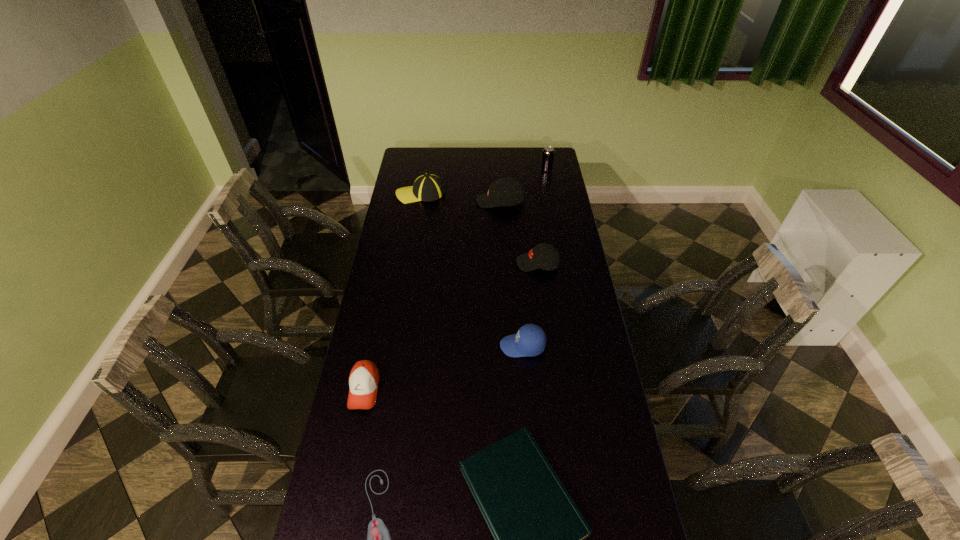
Locate an element on the screen. The width and height of the screenshot is (960, 540). the farthest object is located at coordinates (548, 153).

At what (x,y) coordinates should I click in order to perform the action: click on the third farthest baseball cap. Please return your answer as a coordinate pair (x, y). This screenshot has width=960, height=540. Looking at the image, I should click on (544, 256).

Locate an element on the screen. the fourth nearest object is located at coordinates (530, 340).

I want to click on the nearest baseball cap, so click(x=364, y=378).

You are a GUI agent. You are given a task and a screenshot of the screen. Output one action in this format:
    pyautogui.click(x=<x>, y=<y>)
    Task: Click on the blank area located on the left of the soda can
    The width and height of the screenshot is (960, 540).
    Given the screenshot: What is the action you would take?
    pyautogui.click(x=521, y=170)

The image size is (960, 540). What are the coordinates of `vacant region located on the front-facing side of the fourth farthest object` in the screenshot? It's located at (468, 264).

You are a GUI agent. You are given a task and a screenshot of the screen. Output one action in this format:
    pyautogui.click(x=<x>, y=<y>)
    Task: Click on the vacant space located 0.270m on the front-facing side of the fourth farthest object
    Image resolution: width=960 pixels, height=540 pixels.
    Given the screenshot: What is the action you would take?
    pyautogui.click(x=455, y=264)

Identify the location of vacant position located 0.200m on the front-facing side of the fourth farthest object. (471, 264).

Find the location of `free region located on the front-facing side of the fourth nearest object`. free region located on the front-facing side of the fourth nearest object is located at coordinates click(x=398, y=346).

This screenshot has width=960, height=540. What are the coordinates of `vacant point located 0.330m on the front-facing side of the fourth nearest object` in the screenshot? It's located at (412, 346).